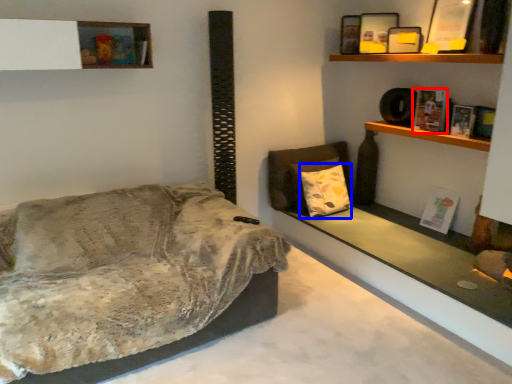
Question: Among these objects, which one is farthest to the camera, book (highlighted by a red box) or pillow (highlighted by a blue box)?

Choices:
 (A) book
 (B) pillow

Answer: (B)